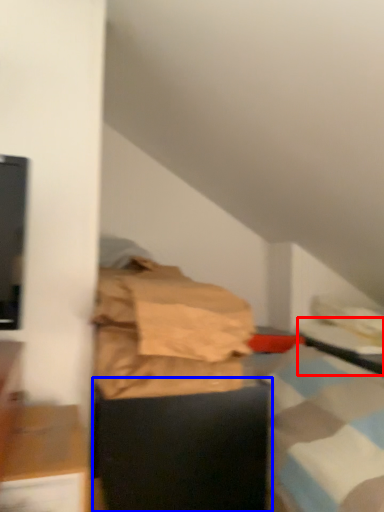
Question: Among these objects, which one is farthest to the camera, table (highlighted by a red box) or furniture (highlighted by a blue box)?

Choices:
 (A) table
 (B) furniture

Answer: (A)